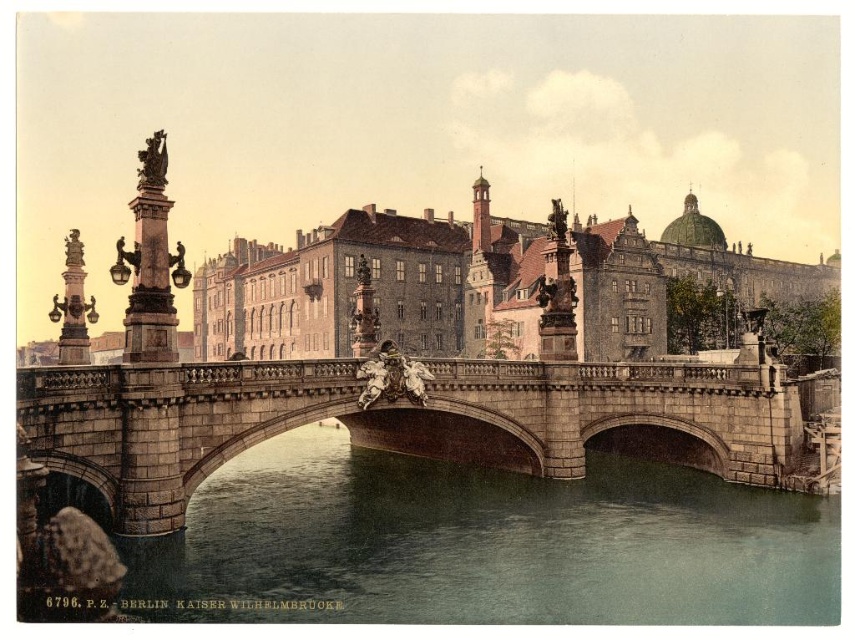
In the image of the Kaiser Wilhelm Bridge in Berlin, there is a point labeled as point (482, 545). What is located at this point?

At point (482, 545) lies greenish stone water at center.

You are a delivery drone with a wingspan of 1.5 meters. You need to fly from the greenish stone water at center to the stone bridge at center. Can you safely pass between them without touching either?

The distance between the greenish stone water at center and the stone bridge at center is 6.57 meters. Since your wingspan is 1.5 meters, you can safely pass between them as the space is more than sufficient for your size.